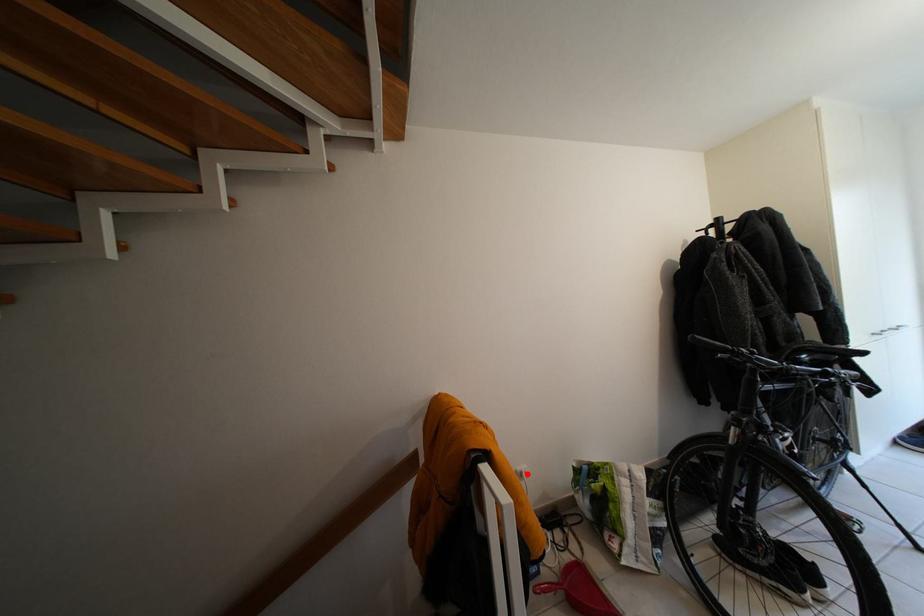
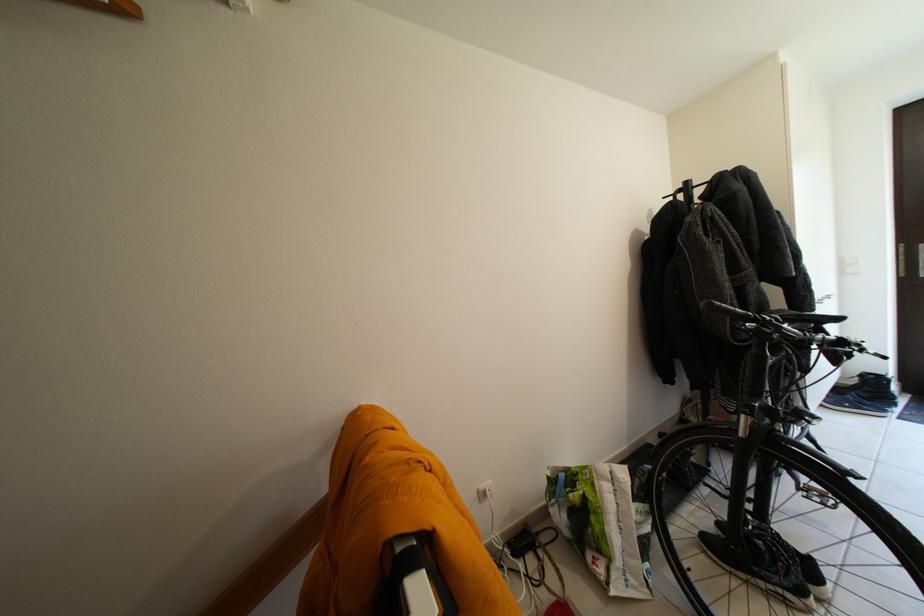
In the second image, find the point that corresponds to the highlighted location in the first image.

(490, 493)